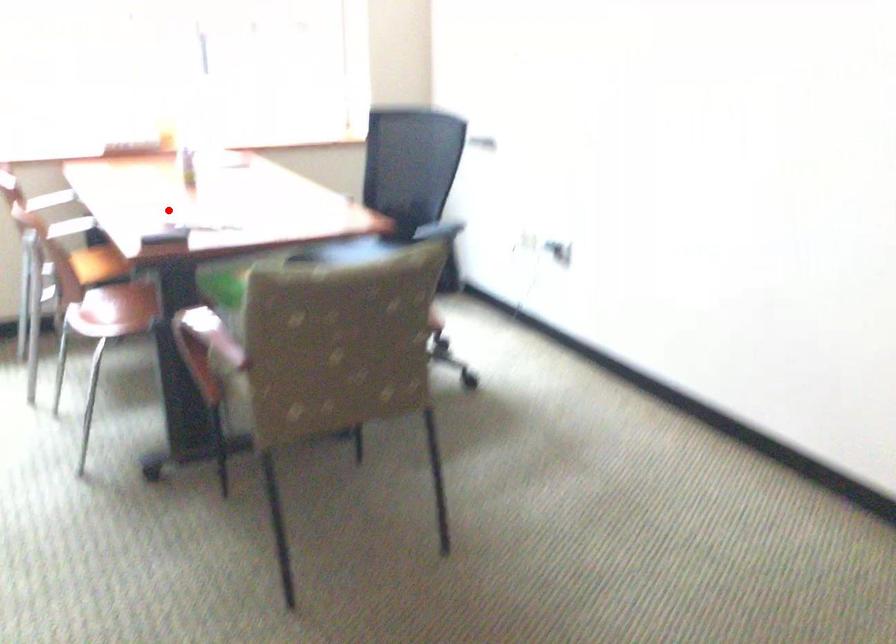
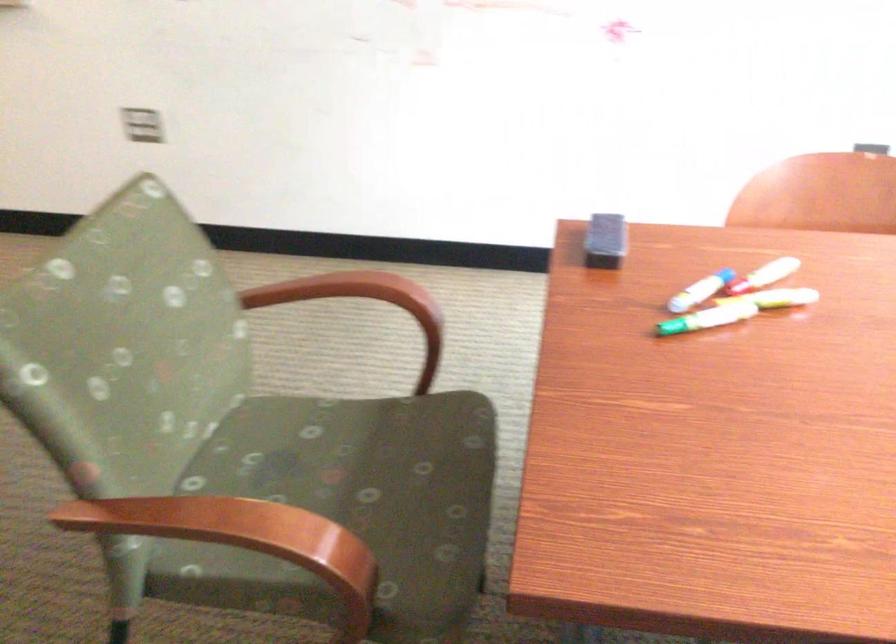
Question: I am providing you with two images of the same scene from different viewpoints. A red point is shown in image1. For the corresponding object point in image2, is it positioned nearer or farther from the camera?

Choices:
 (A) Nearer
 (B) Farther

Answer: (A)